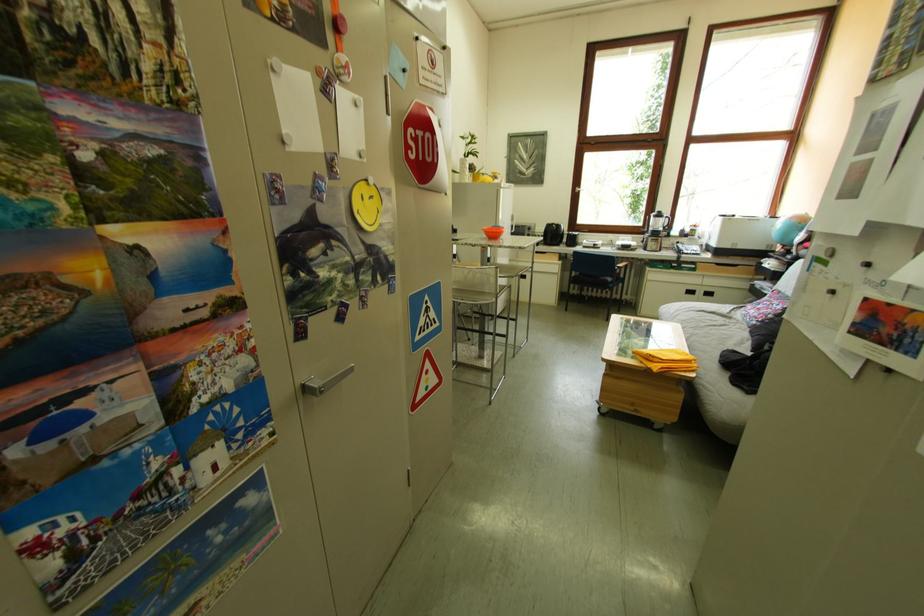
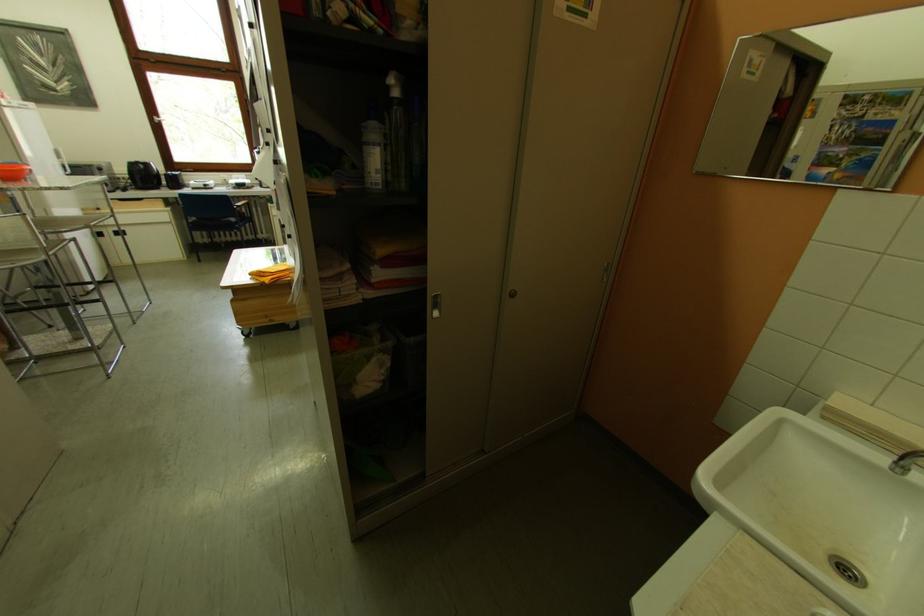
Locate, in the second image, the point that corresponds to (516,262) in the first image.

(79, 214)